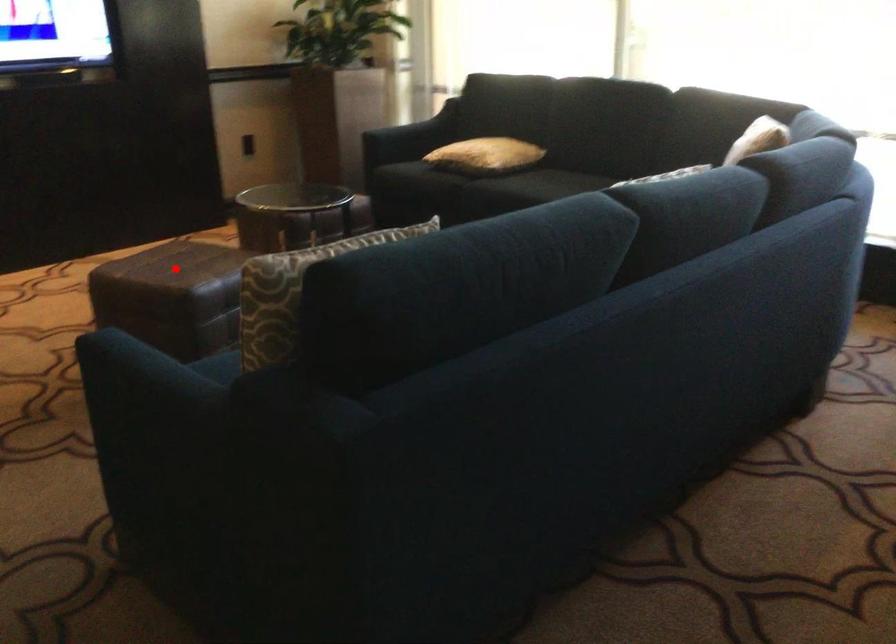
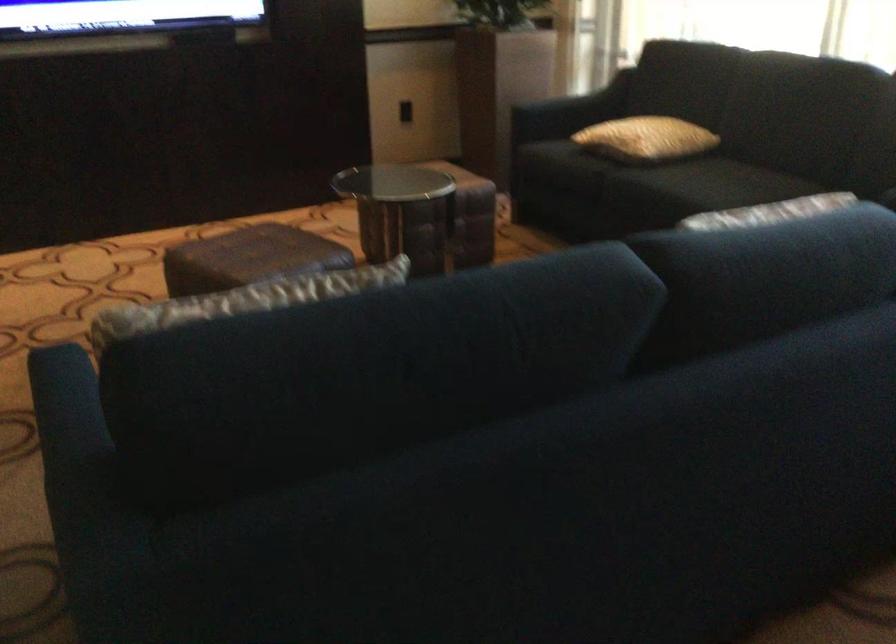
Find the pixel in the second image that matches the highlighted location in the first image.

(248, 258)